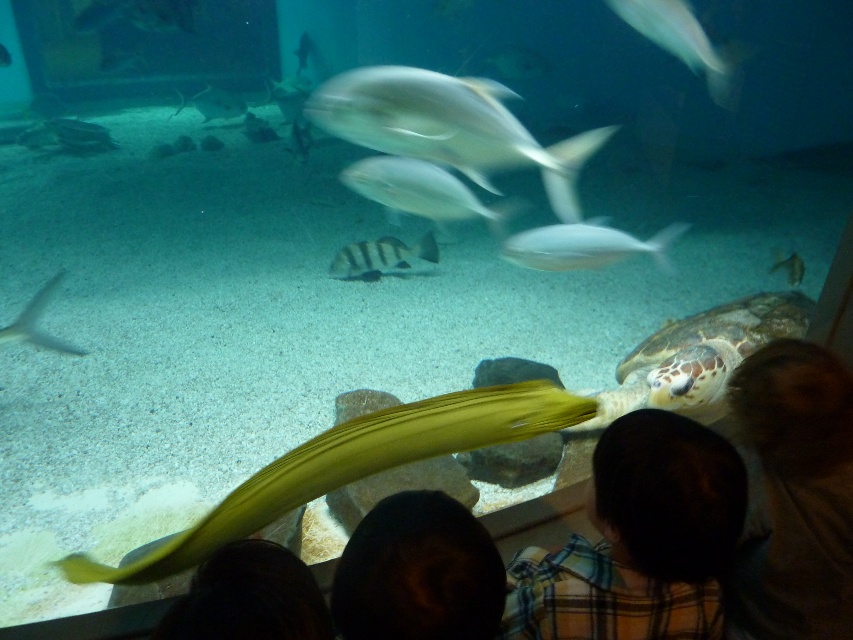
Question: Among these points, which one is farthest from the camera?

Choices:
 (A) coord(675,433)
 (B) coord(3,58)

Answer: (B)

Question: Is leathery brown turtle at lower right to the right of translucent yellowish-green eel at lower left from the viewer's perspective?

Choices:
 (A) yes
 (B) no

Answer: (A)

Question: Which is farther from the plaid fabric shirt at lower right?

Choices:
 (A) smooth yellow snake at center
 (B) leathery brown turtle at lower right
 (C) translucent yellowish-green eel at lower center
 (D) silvery metallic fish at center

Answer: (C)

Question: Which of the following is the farthest from the observer?

Choices:
 (A) (801, 273)
 (B) (428, 248)
 (C) (699, 403)
 (D) (674, 540)

Answer: (B)

Question: Is silvery metallic fish at center to the left of silvery metallic fish at upper center from the viewer's perspective?

Choices:
 (A) yes
 (B) no

Answer: (A)

Question: Can you confirm if dark brown hair at lower center is positioned to the right of silvery metallic fish at center?

Choices:
 (A) no
 (B) yes

Answer: (A)